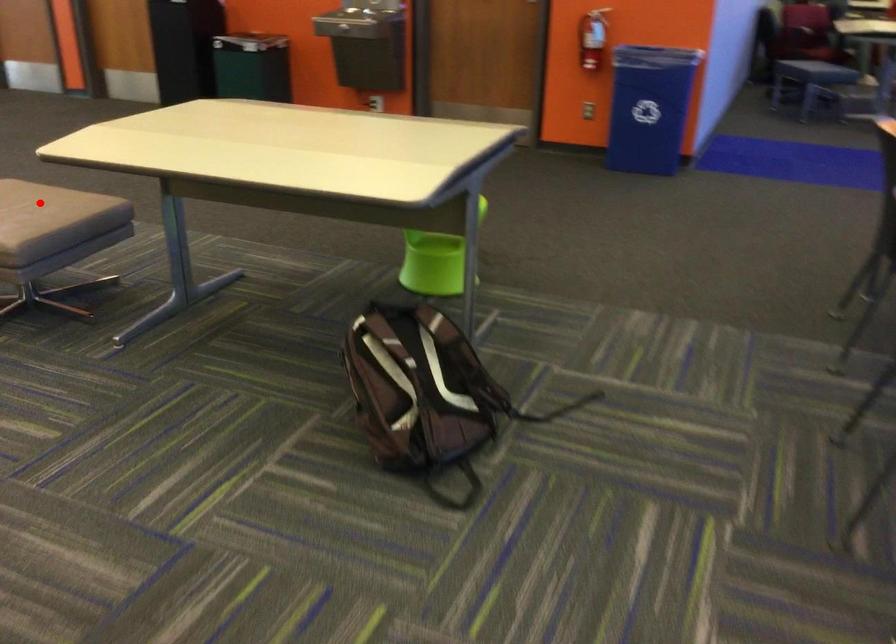
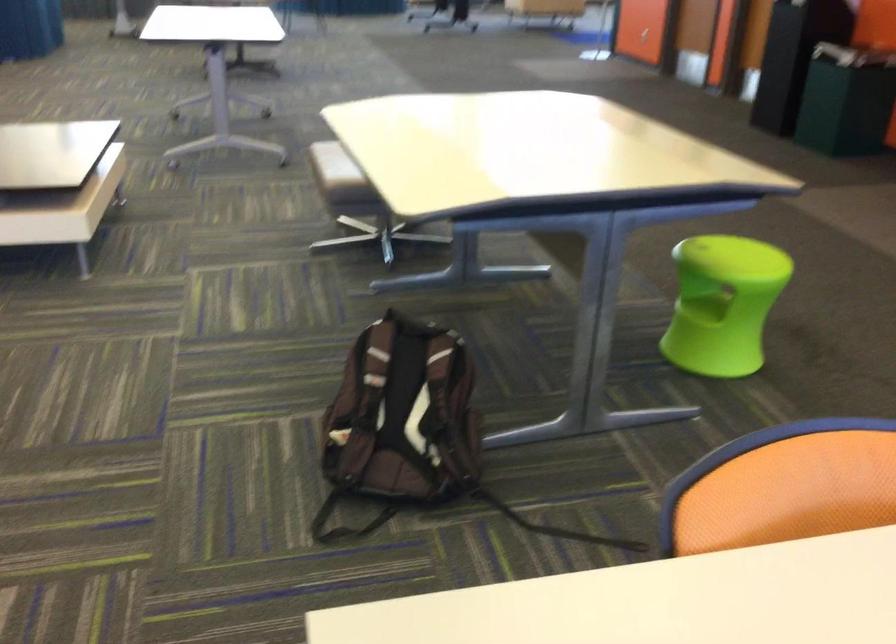
Question: I am providing you with two images of the same scene from different viewpoints. A red point is marked on the first image. Can you still see the location of the red point in image 2?

Choices:
 (A) Yes
 (B) No

Answer: (B)